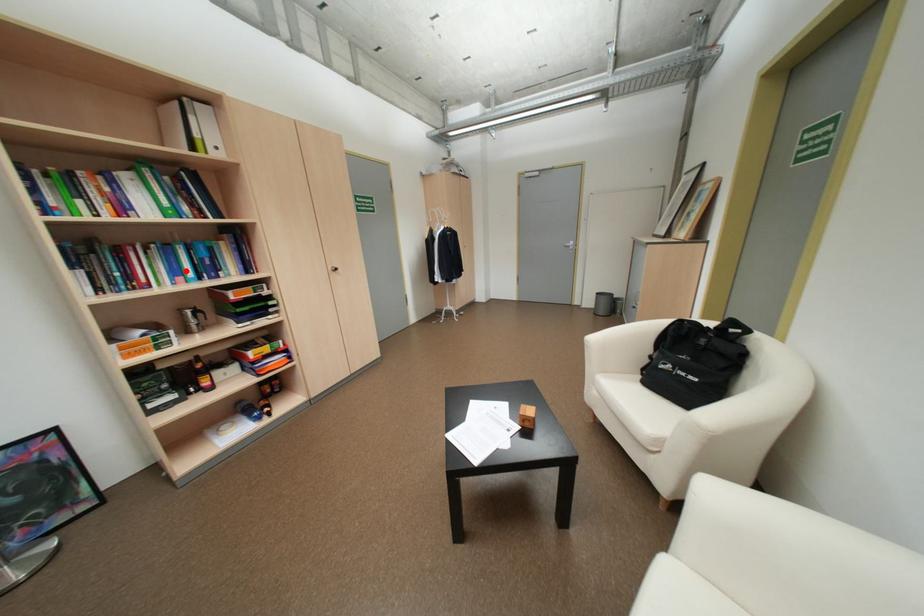
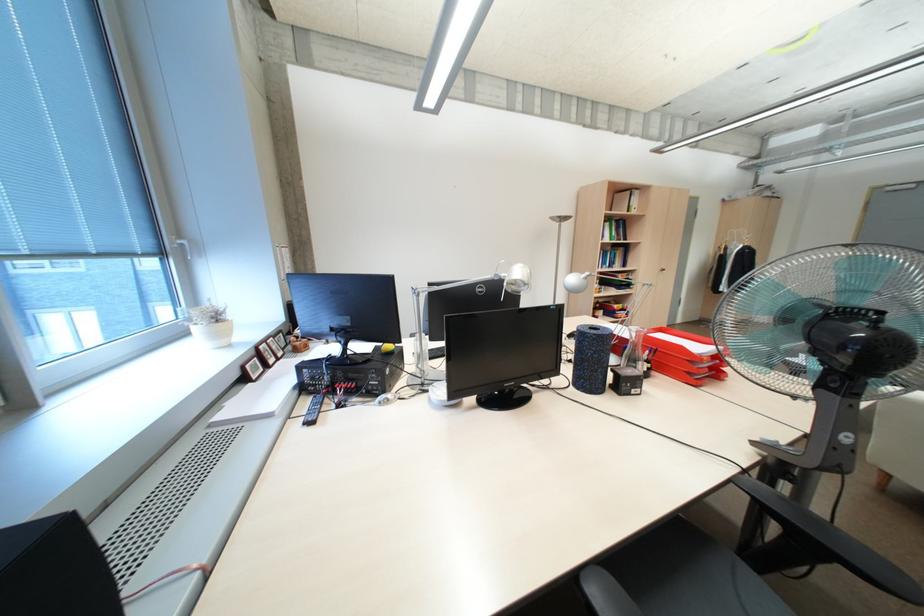
Find the pixel in the second image that matches the highlighted location in the first image.

(614, 262)